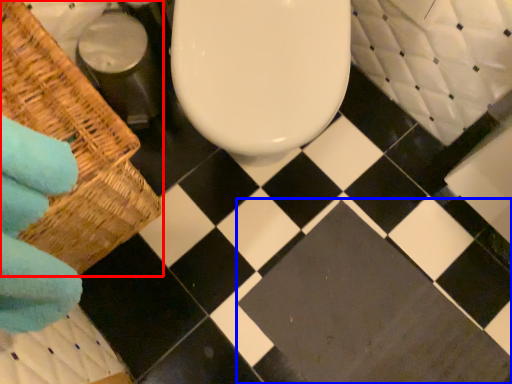
Question: Which object is further to the camera taking this photo, basket (highlighted by a red box) or square (highlighted by a blue box)?

Choices:
 (A) basket
 (B) square

Answer: (B)